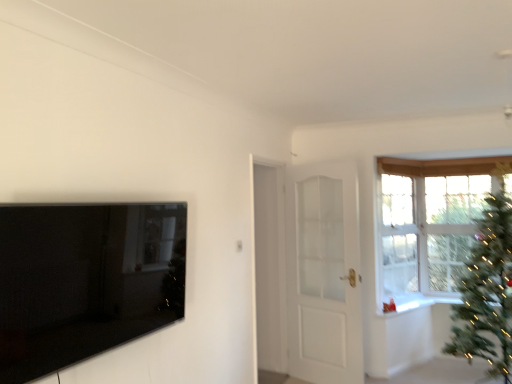
Question: Is green matte christmas tree at right not close to clear glass window at upper right?

Choices:
 (A) yes
 (B) no

Answer: (B)

Question: Could clear glass window at upper right be considered to be inside green matte christmas tree at right?

Choices:
 (A) no
 (B) yes

Answer: (A)

Question: From a real-world perspective, is green matte christmas tree at right located beneath clear glass window at upper right?

Choices:
 (A) yes
 (B) no

Answer: (A)

Question: Is green matte christmas tree at right completely or partially outside of clear glass window at upper right?

Choices:
 (A) yes
 (B) no

Answer: (A)

Question: From a real-world perspective, is green matte christmas tree at right on clear glass window at upper right?

Choices:
 (A) yes
 (B) no

Answer: (B)

Question: Considering the positions of point (485, 208) and point (384, 301), is point (485, 208) closer or farther from the camera than point (384, 301)?

Choices:
 (A) closer
 (B) farther

Answer: (A)

Question: Is green matte christmas tree at right taller or shorter than white glossy window sill at upper right?

Choices:
 (A) short
 (B) tall

Answer: (B)

Question: Which is correct: green matte christmas tree at right is inside white glossy window sill at upper right, or outside of it?

Choices:
 (A) inside
 (B) outside

Answer: (B)

Question: From a real-world perspective, is green matte christmas tree at right above or below white glossy window sill at upper right?

Choices:
 (A) below
 (B) above

Answer: (B)

Question: Is green matte christmas tree at right bigger or smaller than clear glass window at upper right?

Choices:
 (A) big
 (B) small

Answer: (A)

Question: In terms of height, does green matte christmas tree at right look taller or shorter compared to clear glass window at upper right?

Choices:
 (A) tall
 (B) short

Answer: (A)

Question: Is green matte christmas tree at right inside or outside of clear glass window at upper right?

Choices:
 (A) outside
 (B) inside

Answer: (A)

Question: In the image, is green matte christmas tree at right on the left side or the right side of clear glass window at upper right?

Choices:
 (A) right
 (B) left

Answer: (A)

Question: Visually, is white glossy door at center positioned to the left or to the right of green matte christmas tree at right?

Choices:
 (A) left
 (B) right

Answer: (A)

Question: Looking at the image, does white glossy door at center seem bigger or smaller compared to green matte christmas tree at right?

Choices:
 (A) small
 (B) big

Answer: (A)